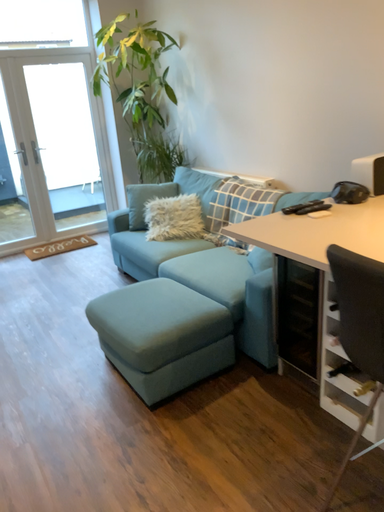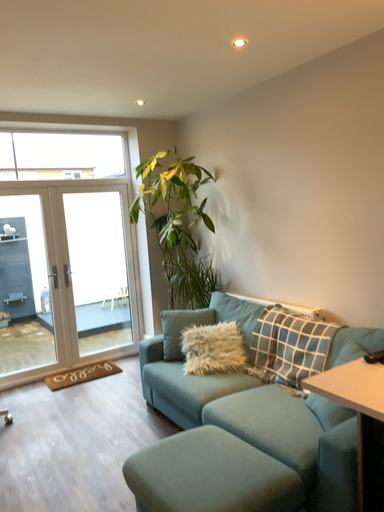
Question: Which way did the camera rotate in the video?

Choices:
 (A) rotated downward
 (B) rotated upward

Answer: (B)